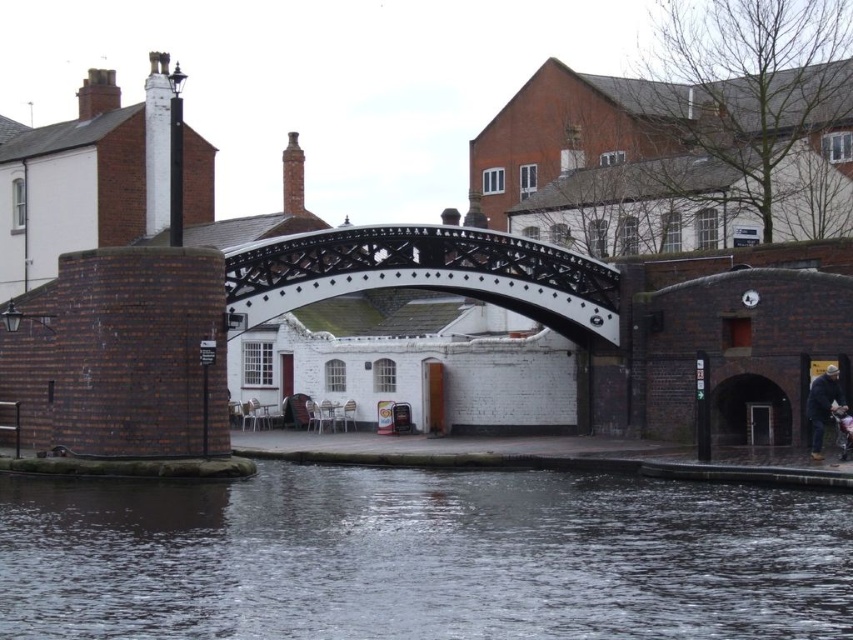
Question: Considering the real-world distances, which object is farthest from the black polished wood bridge at center?

Choices:
 (A) dark blue jacket at lower right
 (B) brown water at lower center

Answer: (A)

Question: Is brown water at lower center below dark blue jacket at lower right?

Choices:
 (A) yes
 (B) no

Answer: (A)

Question: Estimate the real-world distances between objects in this image. Which object is closer to the dark blue jacket at lower right?

Choices:
 (A) brown water at lower center
 (B) black polished wood bridge at center

Answer: (B)

Question: Which of these objects is positioned closest to the dark blue jacket at lower right?

Choices:
 (A) black polished wood bridge at center
 (B) brown water at lower center

Answer: (A)

Question: From the image, what is the correct spatial relationship of brown water at lower center in relation to dark blue jacket at lower right?

Choices:
 (A) right
 (B) left

Answer: (B)

Question: Observing the image, what is the correct spatial positioning of brown water at lower center in reference to black polished wood bridge at center?

Choices:
 (A) left
 (B) right

Answer: (A)